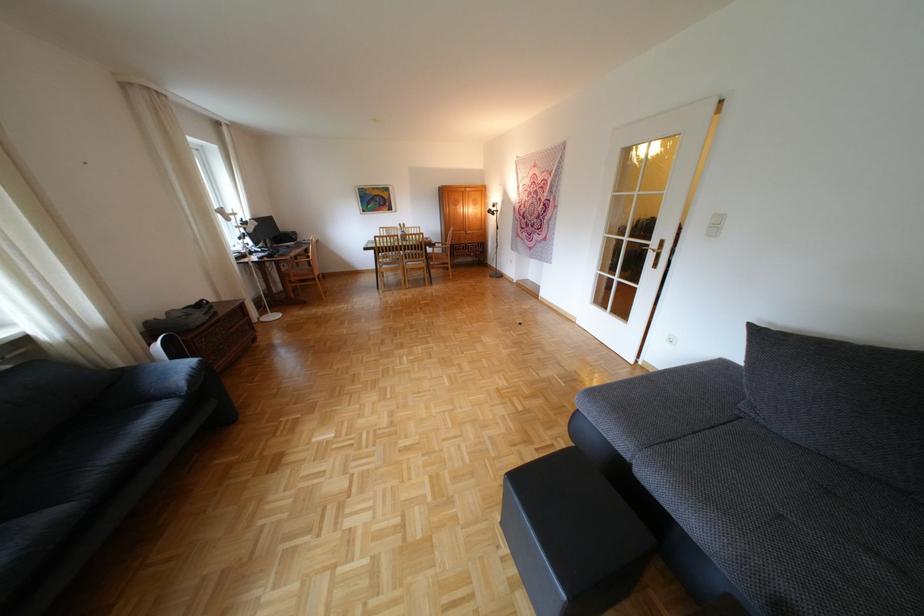
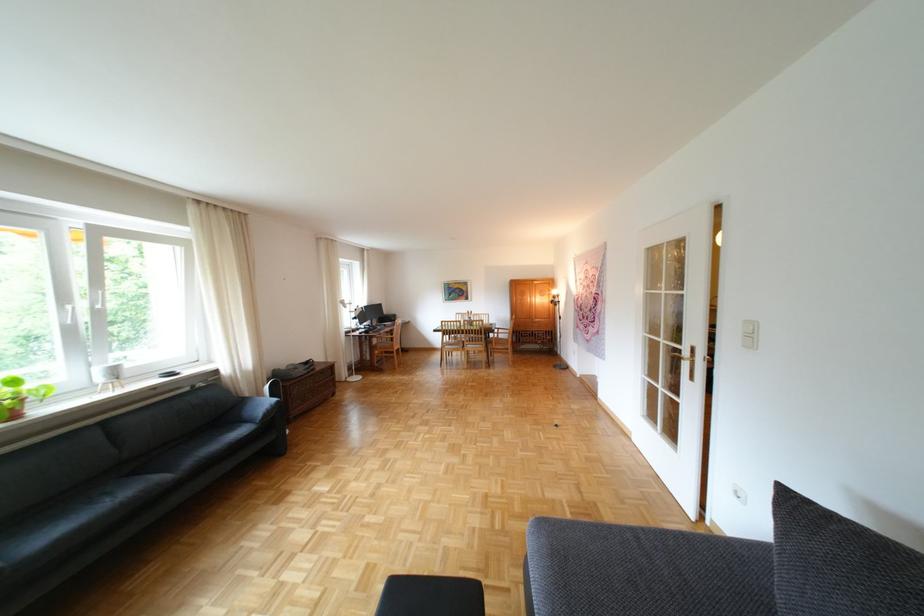
Where in the second image is the point corresponding to [179,395] from the first image?

(263, 421)